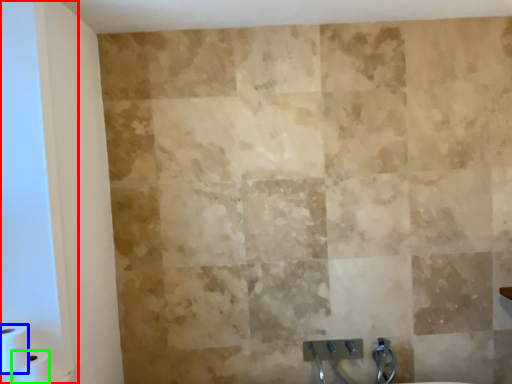
Question: Based on their relative distances, which object is farther from glass door (highlighted by a red box)? Choose from toilet paper (highlighted by a blue box) and toilet paper (highlighted by a green box).

Choices:
 (A) toilet paper
 (B) toilet paper

Answer: (B)